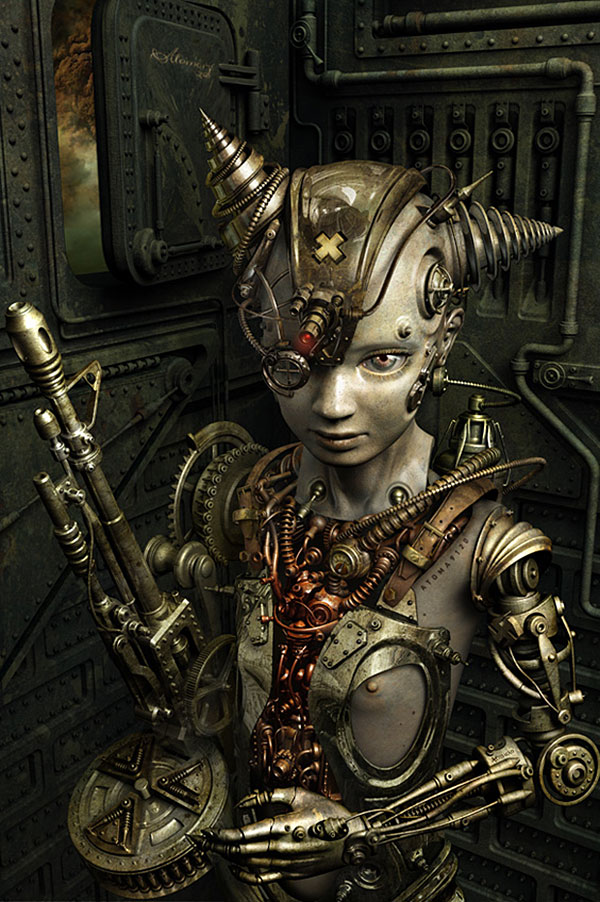
Identify the location of chest. (311, 666).